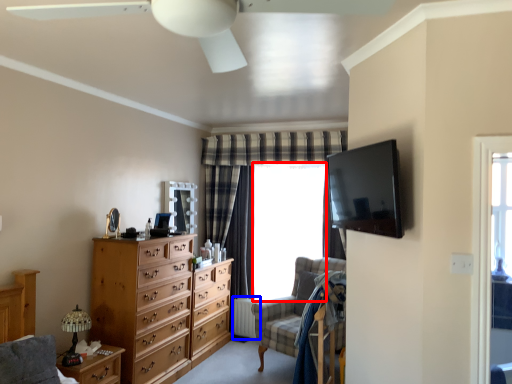
Question: Which object appears farthest to the camera in this image, window screen (highlighted by a red box) or radiator (highlighted by a blue box)?

Choices:
 (A) window screen
 (B) radiator

Answer: (B)